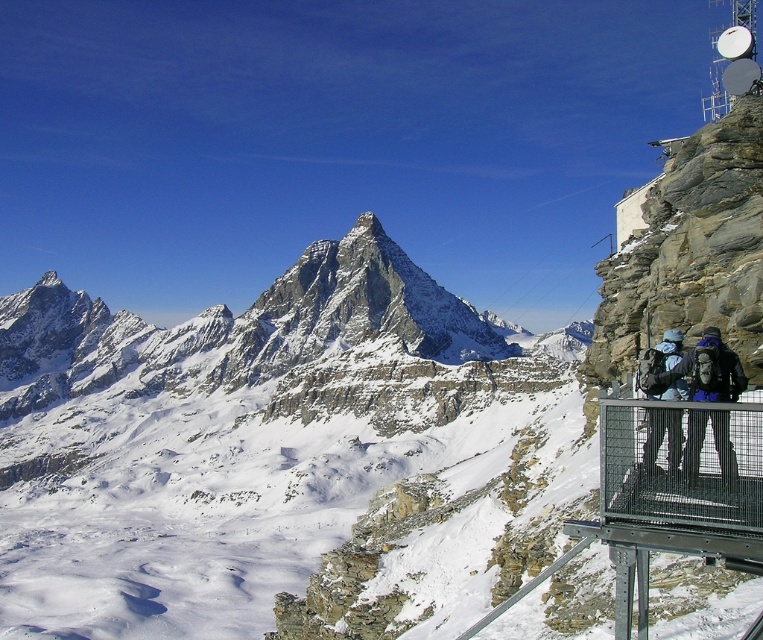
Consider the image. Is dark gray backpack at right closer to camera compared to dark blue fabric backpack at right?

Yes.

Between point (716, 371) and point (660, 396), which one is positioned in front?

Point (716, 371)

Is point (710, 394) less distant than point (652, 371)?

Yes, it is.

The width and height of the screenshot is (763, 640). Find the location of `dark gray backpack at right`. dark gray backpack at right is located at coordinates [x=710, y=371].